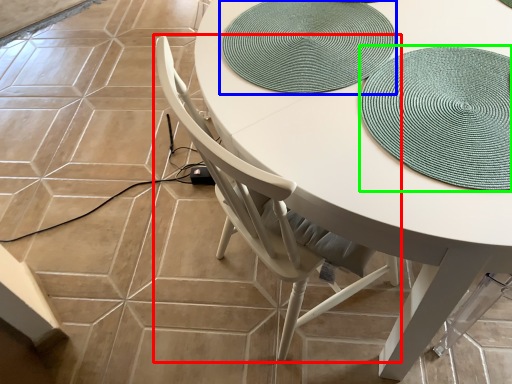
Question: Estimate the real-world distances between objects in this image. Which object is farther from chair (highlighted by a red box), mat (highlighted by a blue box) or hat (highlighted by a green box)?

Choices:
 (A) mat
 (B) hat

Answer: (B)